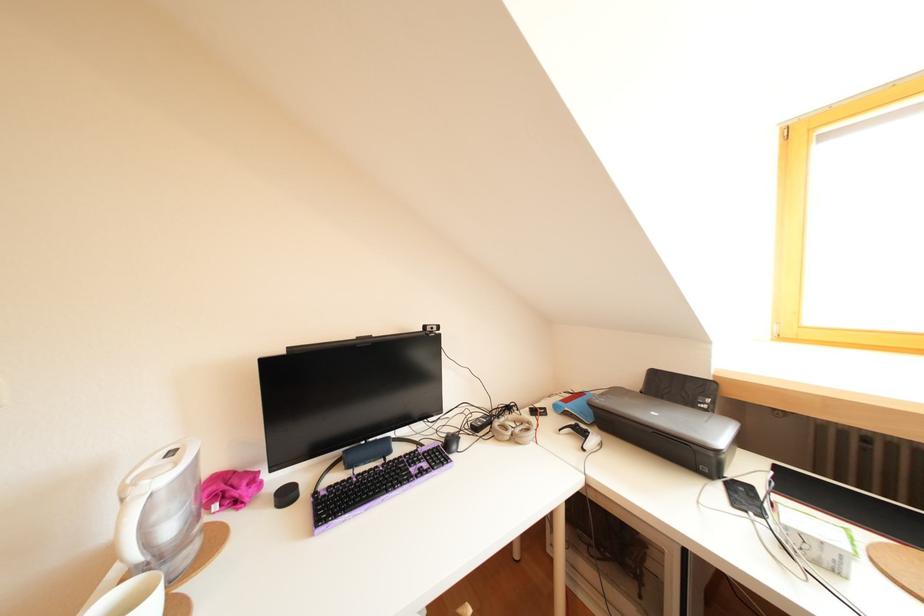
Where would you click the black computer mouse? Please return your answer as a coordinate pair (x, y).

(451, 442)